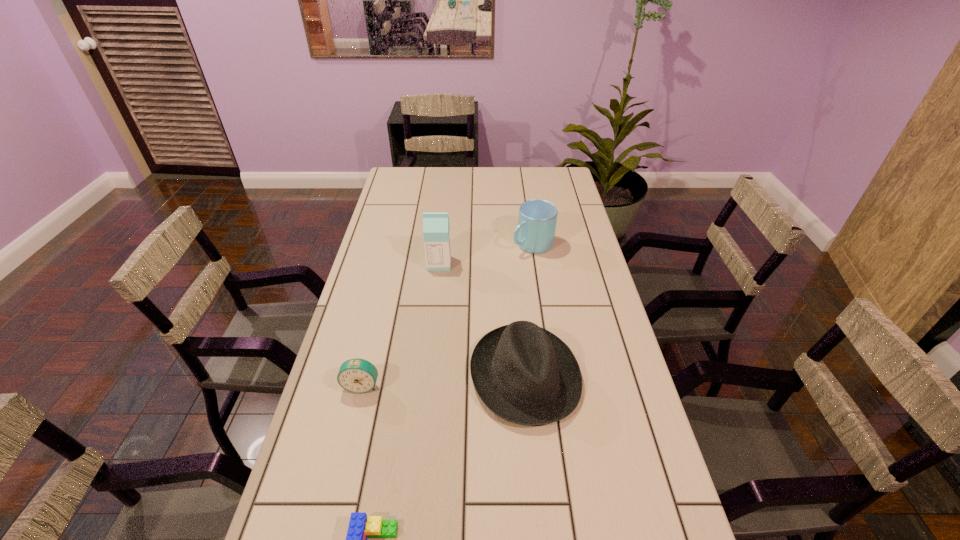
Locate an element on the screen. This screenshot has width=960, height=540. object that ranks as the second closest to the Lego is located at coordinates tap(357, 375).